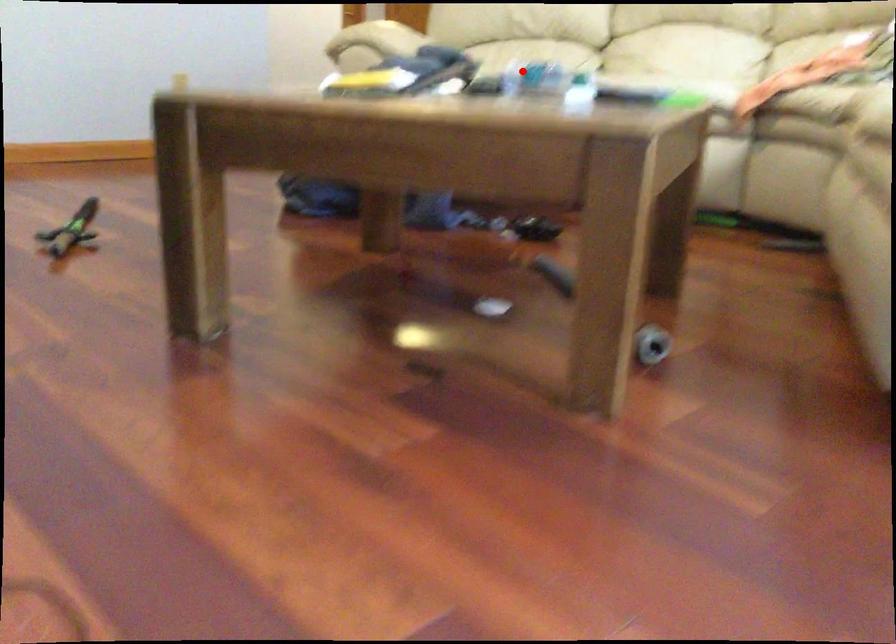
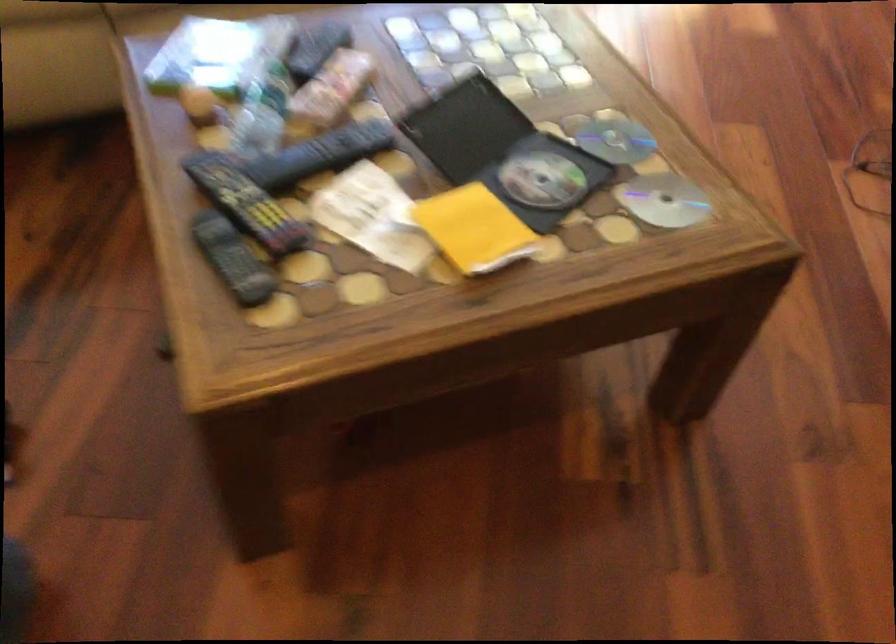
Question: I am providing you with two images of the same scene from different viewpoints. In image1, a red point is highlighted. Considering the same 3D point in image2, which of the following is correct?

Choices:
 (A) It is closer
 (B) It is farther

Answer: (A)